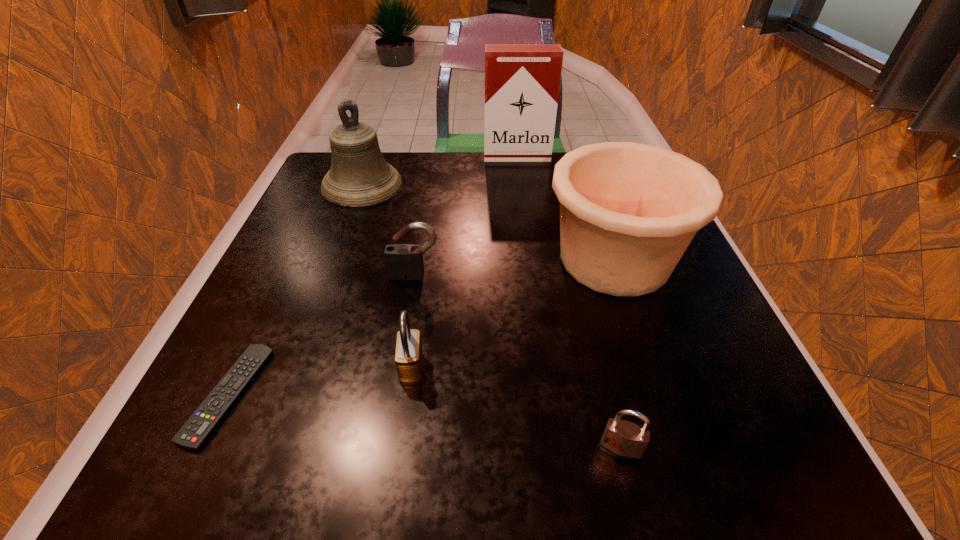
This screenshot has height=540, width=960. Find the location of `empty space that is in between the pottery and the shortest object`. empty space that is in between the pottery and the shortest object is located at coordinates (421, 327).

Where is `free spot between the second farthest padlock and the farthest object`? Image resolution: width=960 pixels, height=540 pixels. free spot between the second farthest padlock and the farthest object is located at coordinates (465, 262).

Where is `free space between the tallest object and the second farthest padlock`? The image size is (960, 540). free space between the tallest object and the second farthest padlock is located at coordinates (465, 262).

Locate an element on the screen. free space between the second farthest object and the second farthest padlock is located at coordinates pos(387,276).

Where is `vacant point located between the sixth nearest object and the shortest object`? vacant point located between the sixth nearest object and the shortest object is located at coordinates (295, 290).

Locate an element on the screen. The height and width of the screenshot is (540, 960). vacant space that is in between the remote control and the farthest object is located at coordinates (372, 275).

At what (x,y) coordinates should I click in order to perform the action: click on free area in between the farthest padlock and the rightmost padlock. Please return your answer as a coordinate pair (x, y). Looking at the image, I should click on tap(517, 362).

Where is `free space between the pottery and the farthest padlock`? The image size is (960, 540). free space between the pottery and the farthest padlock is located at coordinates (515, 267).

The height and width of the screenshot is (540, 960). Identify the location of the second closest object relative to the sixth tallest object. (408, 357).

Identify which object is the fourth nearest to the farthest object. Please provide its 2D coordinates. Your answer should be formatted as a tuple, i.e. [(x, y)], where the tuple contains the x and y coordinates of a point satisfying the conditions above.

[(408, 357)]